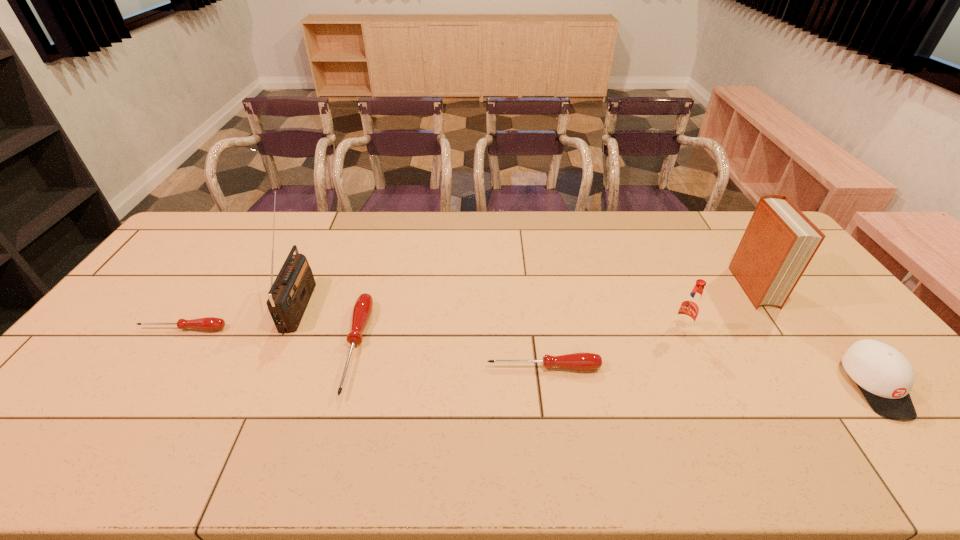
All screwdrivers are currently evenly spaced. To continue this pattern, where would you add another screwdriver on the right? Please point out a vacant spot. Please provide its 2D coordinates. Your answer should be formatted as a tuple, i.e. [(x, y)], where the tuple contains the x and y coordinates of a point satisfying the conditions above.

[(749, 389)]